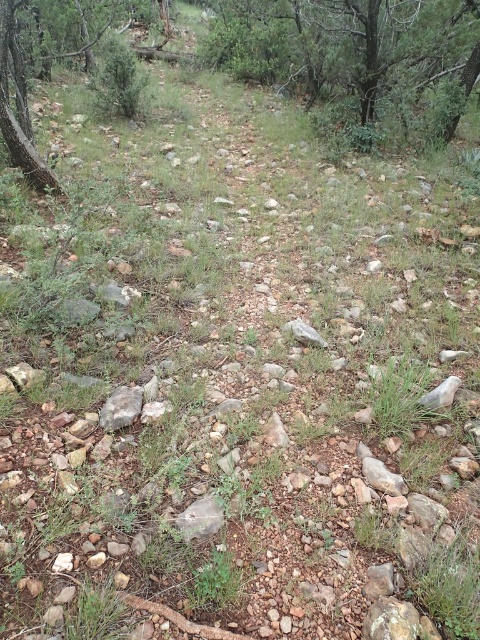
Consider the image. Can you confirm if green leafy tree at upper center is taller than gray rock at center?

Indeed, green leafy tree at upper center has a greater height compared to gray rock at center.

Between green leafy tree at upper center and gray rock at center, which one appears on the right side from the viewer's perspective?

gray rock at center is more to the right.

Between point (432, 122) and point (402, 481), which one is positioned in front?

Point (402, 481) is in front.

Where is `green leafy tree at upper center`? The height and width of the screenshot is (640, 480). green leafy tree at upper center is located at coordinates (357, 58).